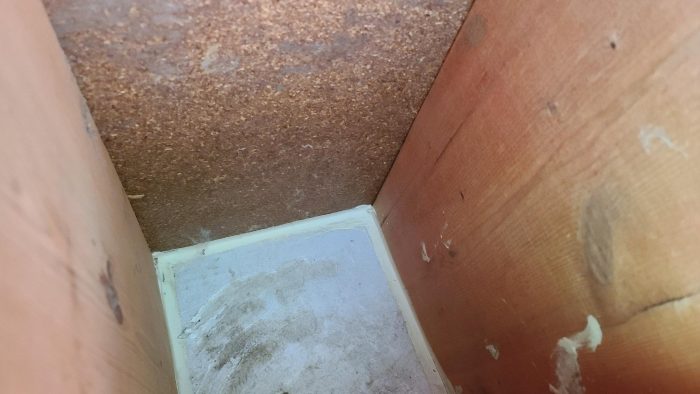
Identify the location of white frame edge. This screenshot has height=394, width=700. (372, 227).